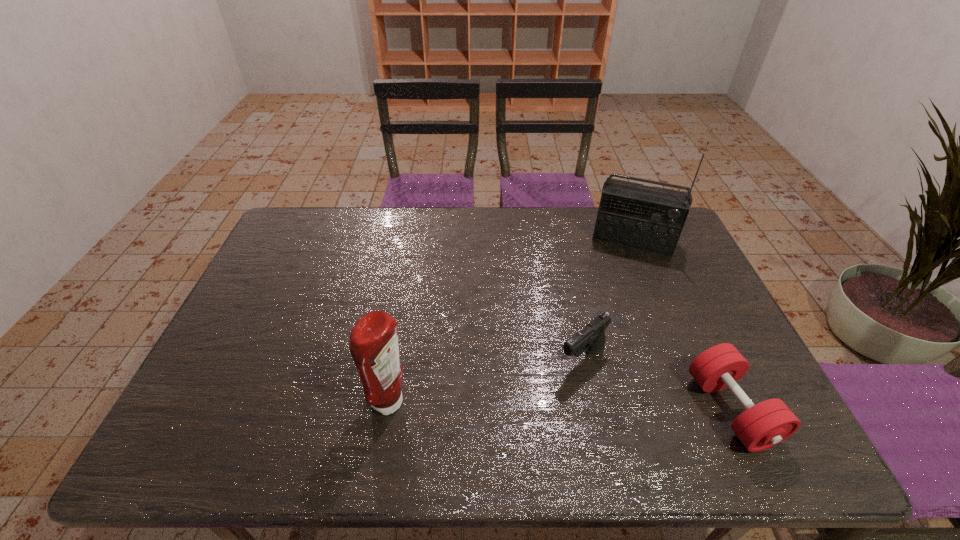
Where is `free spot that satisfies the following two spatial constraints: 1. on the front side of the radio receiver; 2. on the right side of the dumbbell`? free spot that satisfies the following two spatial constraints: 1. on the front side of the radio receiver; 2. on the right side of the dumbbell is located at coordinates pos(703,409).

Image resolution: width=960 pixels, height=540 pixels. I want to click on vacant area in the image that satisfies the following two spatial constraints: 1. on the front side of the dumbbell; 2. on the right side of the second tallest object, so click(x=389, y=409).